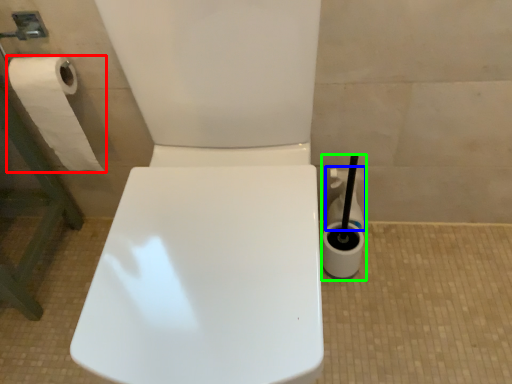
Question: Which object is positioned farthest from toilet paper (highlighted by a red box)? Select from cleaning product (highlighted by a blue box) and cleaning product (highlighted by a green box).

Choices:
 (A) cleaning product
 (B) cleaning product

Answer: (B)